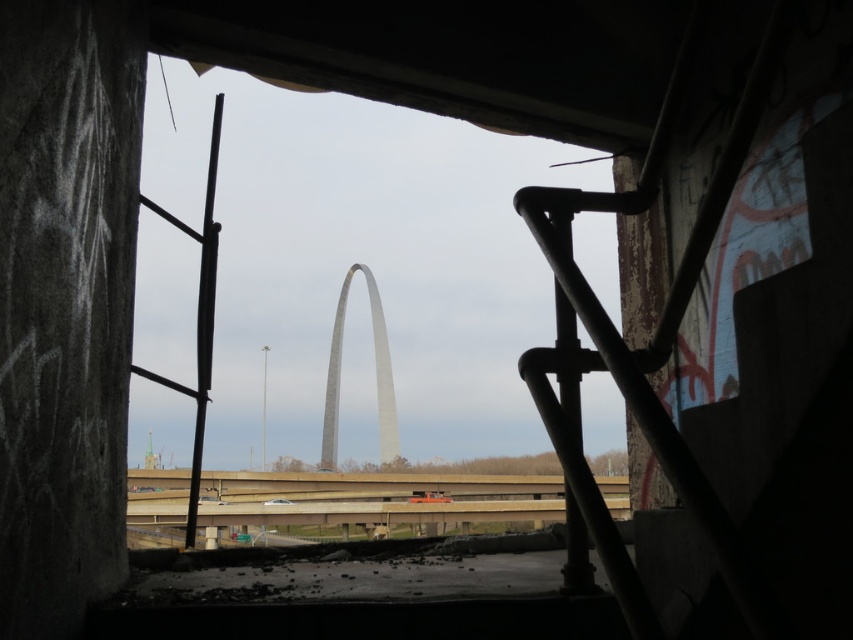
Question: Can you confirm if rusty metal ladder at left is bigger than gray metallic arch at center?

Choices:
 (A) yes
 (B) no

Answer: (A)

Question: Which point appears farthest from the camera in this image?

Choices:
 (A) (334, 328)
 (B) (202, 429)

Answer: (A)

Question: Does rusty metal ladder at left appear on the right side of gray metallic arch at center?

Choices:
 (A) no
 (B) yes

Answer: (A)

Question: Observing the image, what is the correct spatial positioning of rusty metal ladder at left in reference to gray metallic arch at center?

Choices:
 (A) below
 (B) above

Answer: (B)

Question: Which point appears farthest from the camera in this image?

Choices:
 (A) pos(183,228)
 (B) pos(376,310)

Answer: (B)

Question: Which object is farther from the camera taking this photo?

Choices:
 (A) gray metallic arch at center
 (B) rusty metal ladder at left

Answer: (A)